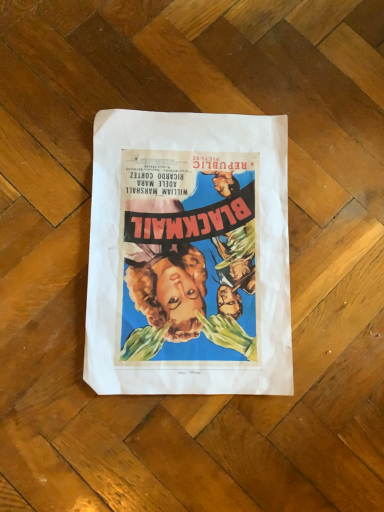
Where is `free spot above matte paper poster at center (from a real-world perspective)`? The height and width of the screenshot is (512, 384). free spot above matte paper poster at center (from a real-world perspective) is located at coordinates (200, 239).